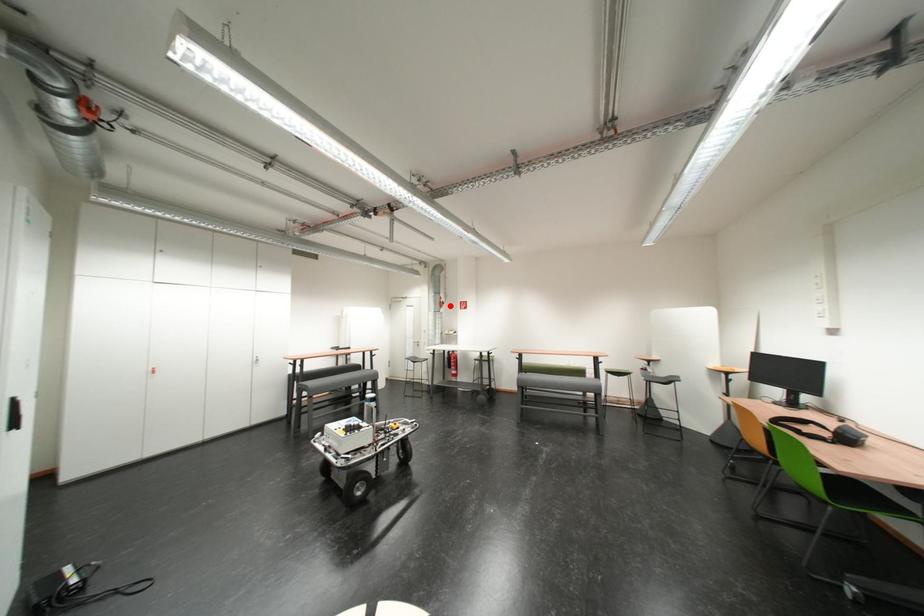
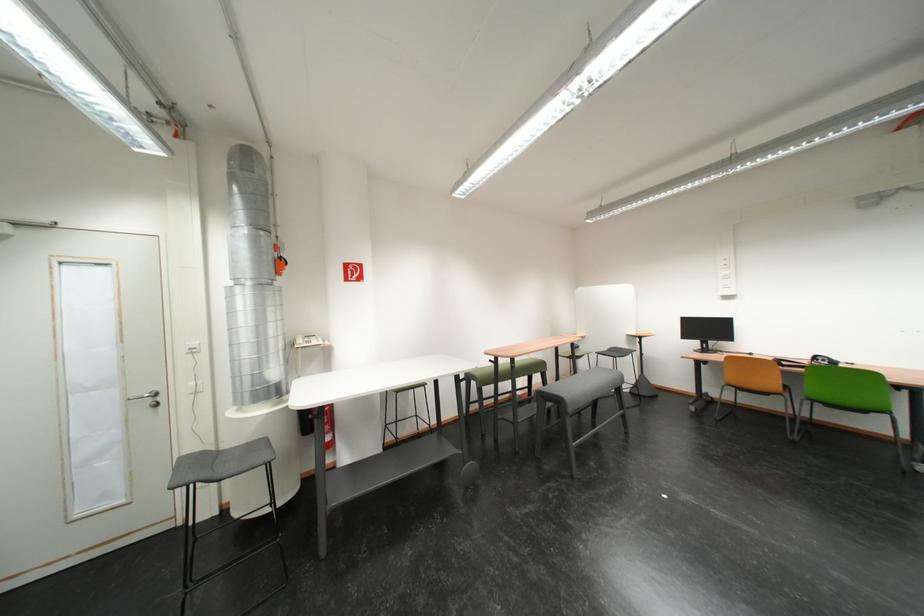
In the second image, find the point that corresponds to the highlighted location in the first image.

(284, 265)